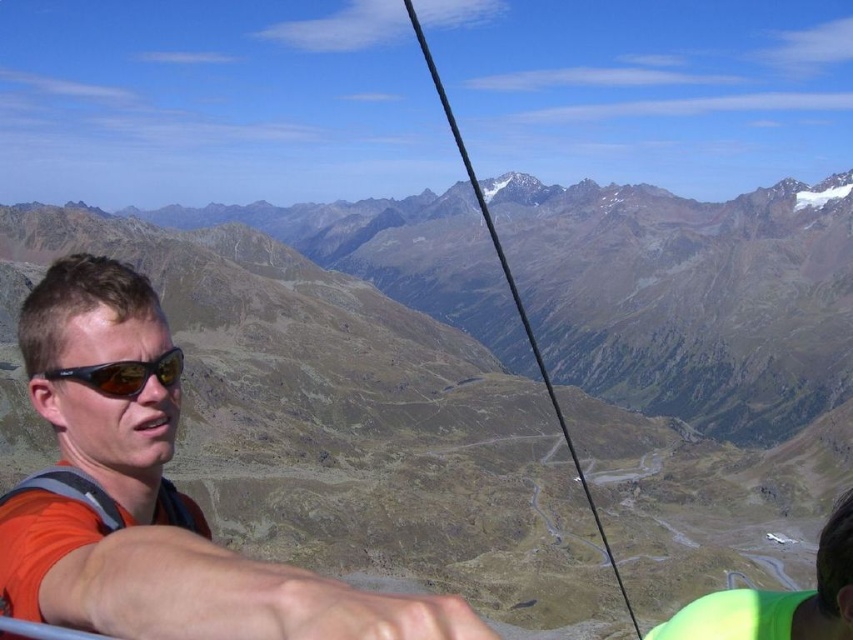
You are a drone operator planning to fly a drone from the matte black goggles at left to the brown rocky mountain at center. The drone has a maximum flight range of 600 feet. Based on the scene, will the drone be able to reach the mountain?

The brown rocky mountain at center is 627.53 feet away from matte black goggles at left. Since the drone can only fly up to 600 feet, it cannot reach the mountain.

Looking at this image, you are standing in the cable car and want to take a selfie with the brown rocky mountain at center. The camera you are using has a maximum focus range of 90 meters. Will the mountain be in focus in your photo?

The distance between the brown rocky mountain at center and the viewer is 91.14 meters, which exceeds the camera maximum focus range of 90 meters. Therefore, the mountain will not be in focus in the photo.

You are a photographer planning to take a photo of the brown rocky mountain at center and the matte black goggles at left. Based on their positions, which object will appear closer to the camera in the final photo?

The brown rocky mountain at center will appear closer to the camera in the final photo because the matte black goggles at left is behind it, meaning the mountain is in front of the goggles.